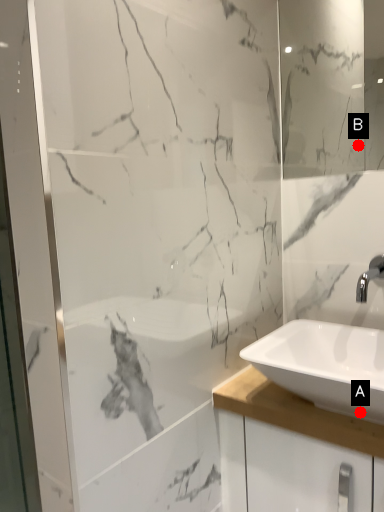
Question: Two points are circled on the image, labeled by A and B beside each circle. Which point is closer to the camera?

Choices:
 (A) A is closer
 (B) B is closer

Answer: (A)